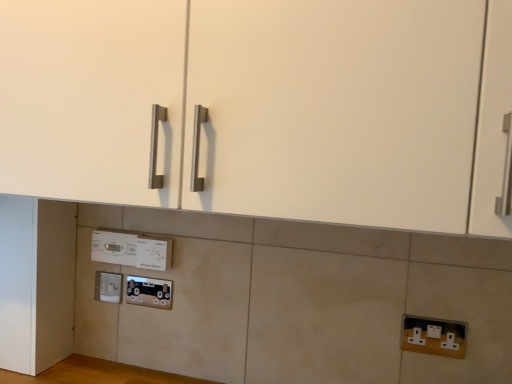
Where is `metallic socket at lower center`? metallic socket at lower center is located at coordinates (149, 292).

What are the coordinates of `white plastic electric outlet at lower center, acting as the 3th electric outlet starting from the bottom` in the screenshot? It's located at (153, 253).

Describe the element at coordinates (153, 253) in the screenshot. The width and height of the screenshot is (512, 384). I see `white plastic electric outlet at lower center, the 2th electric outlet positioned from the left` at that location.

This screenshot has width=512, height=384. I want to click on white plastic electric outlet at lower right, the 1th electric outlet from the right, so click(x=434, y=336).

Where is `white plastic electric outlet at lower left, which is the first electric outlet in back-to-front order`? white plastic electric outlet at lower left, which is the first electric outlet in back-to-front order is located at coordinates (108, 286).

Measure the distance from white plastic thermostat at center to white plastic electric outlet at lower center, which is counted as the 2th electric outlet, starting from the back.

The distance of white plastic thermostat at center from white plastic electric outlet at lower center, which is counted as the 2th electric outlet, starting from the back, is 2.60 inches.

Is white plastic thermostat at center facing towards white plastic electric outlet at lower center, which is the second electric outlet from front to back?

No.

Is white plastic thermostat at center in front of or behind white plastic electric outlet at lower center, which is the second electric outlet from front to back, in the image?

Clearly, white plastic thermostat at center is behind white plastic electric outlet at lower center, which is the second electric outlet from front to back.

Find the location of a particular element. Image resolution: width=512 pixels, height=384 pixels. the 1st electric outlet below the white plastic thermostat at center (from the image's perspective) is located at coordinates (153, 253).

From a real-world perspective, between white plastic electric outlet at lower center, which is counted as the second electric outlet, starting from the right, and white plastic thermostat at center, who is vertically higher?

white plastic thermostat at center is physically above.

From the white plastic thermostat at center, count 1st electric outlets forward and point to it. Please provide its 2D coordinates.

[(153, 253)]

Is white plastic electric outlet at lower center, acting as the 3th electric outlet starting from the bottom, aimed at white plastic thermostat at center?

No, white plastic electric outlet at lower center, acting as the 3th electric outlet starting from the bottom, is not aimed at white plastic thermostat at center.

Is point (138, 242) in front of point (115, 251)?

Yes.

From a real-world perspective, is white plastic electric outlet at lower center, the 2th electric outlet positioned from the left, located beneath white plastic electric outlet at lower left, the 2th electric outlet in the bottom-to-top sequence?

Actually, white plastic electric outlet at lower center, the 2th electric outlet positioned from the left, is physically above white plastic electric outlet at lower left, the 2th electric outlet in the bottom-to-top sequence, in the real world.

Is white plastic electric outlet at lower left, which ranks as the third electric outlet in right-to-left order, a part of white plastic electric outlet at lower center, which is counted as the 2th electric outlet, starting from the back?

No, white plastic electric outlet at lower left, which ranks as the third electric outlet in right-to-left order, is not a part of white plastic electric outlet at lower center, which is counted as the 2th electric outlet, starting from the back.

Locate an element on the screen. The width and height of the screenshot is (512, 384). the 1st electric outlet in front of the white plastic electric outlet at lower left, which is counted as the 2th electric outlet, starting from the top is located at coordinates (153, 253).

How distant is white plastic electric outlet at lower center, which is counted as the second electric outlet, starting from the right, from white plastic electric outlet at lower left, which ranks as the third electric outlet in right-to-left order?

5.91 inches.

Does white plastic electric outlet at lower left, which is the 1th electric outlet in left-to-right order, lie behind white plastic electric outlet at lower right, positioned as the 3th electric outlet in left-to-right order?

Yes, white plastic electric outlet at lower left, which is the 1th electric outlet in left-to-right order, is further from the viewer.

From a real-world perspective, who is located higher, white plastic electric outlet at lower left, acting as the third electric outlet starting from the front, or white plastic electric outlet at lower right, positioned as the 3th electric outlet in left-to-right order?

From a 3D spatial view, white plastic electric outlet at lower left, acting as the third electric outlet starting from the front, is above.

Consider the image. Considering the relative sizes of white plastic electric outlet at lower left, acting as the third electric outlet starting from the front, and white plastic electric outlet at lower right, placed as the third electric outlet when sorted from back to front, in the image provided, is white plastic electric outlet at lower left, acting as the third electric outlet starting from the front, smaller than white plastic electric outlet at lower right, placed as the third electric outlet when sorted from back to front,?

Yes.

Is white plastic electric outlet at lower left, which ranks as the third electric outlet in right-to-left order, to the left of white plastic electric outlet at lower right, placed as the third electric outlet when sorted from back to front, from the viewer's perspective?

Yes, white plastic electric outlet at lower left, which ranks as the third electric outlet in right-to-left order, is to the left of white plastic electric outlet at lower right, placed as the third electric outlet when sorted from back to front.

Does white plastic electric outlet at lower center, which is counted as the second electric outlet, starting from the right, touch metallic socket at lower center?

Yes, white plastic electric outlet at lower center, which is counted as the second electric outlet, starting from the right, is with metallic socket at lower center.

Choose the correct answer: Is white plastic electric outlet at lower center, which is the second electric outlet from front to back, inside metallic socket at lower center or outside it?

white plastic electric outlet at lower center, which is the second electric outlet from front to back, is not inside metallic socket at lower center, it's outside.

Who is bigger, white plastic electric outlet at lower center, acting as the 3th electric outlet starting from the bottom, or metallic socket at lower center?

white plastic electric outlet at lower center, acting as the 3th electric outlet starting from the bottom, is bigger.

Is white plastic electric outlet at lower right, the 1th electric outlet from the right, turned away from white plastic thermostat at center?

That's not correct — white plastic electric outlet at lower right, the 1th electric outlet from the right, is not looking away from white plastic thermostat at center.

Does white plastic electric outlet at lower right, the 1th electric outlet from the right, have a greater width compared to white plastic thermostat at center?

No.

Considering the positions of point (403, 326) and point (105, 246), is point (403, 326) closer or farther from the camera than point (105, 246)?

Clearly, point (403, 326) is closer to the camera than point (105, 246).

At what (x,y) coordinates should I click in order to perform the action: click on appliance that is above the white plastic electric outlet at lower right, the 3th electric outlet from the top (from a real-world perspective). Please return your answer as a coordinate pair (x, y). The image size is (512, 384). Looking at the image, I should click on 114,247.

Is point (52, 338) closer to camera compared to point (434, 332)?

No, it is behind (434, 332).

Who is smaller, white matte door at lower left or white plastic electric outlet at lower right, the 1th electric outlet from the right?

With smaller size is white plastic electric outlet at lower right, the 1th electric outlet from the right.

From a real-world perspective, is white matte door at lower left beneath white plastic electric outlet at lower right, placed as the third electric outlet when sorted from back to front?

No.

Between white matte door at lower left and white plastic electric outlet at lower right, acting as the first electric outlet starting from the bottom, which one has more height?

white matte door at lower left is taller.

Which electric outlet is the 1st one when counting from the front of the white plastic thermostat at center? Please provide its 2D coordinates.

[(153, 253)]

This screenshot has height=384, width=512. There is a white plastic thermostat at center. Find the location of `the 1st electric outlet below it (from a real-world perspective)`. the 1st electric outlet below it (from a real-world perspective) is located at coordinates (153, 253).

Estimate the real-world distances between objects in this image. Which object is closer to white plastic electric outlet at lower center, acting as the 3th electric outlet starting from the bottom, white matte door at lower left or white plastic electric outlet at lower left, which is counted as the 2th electric outlet, starting from the top?

white plastic electric outlet at lower left, which is counted as the 2th electric outlet, starting from the top, lies closer to white plastic electric outlet at lower center, acting as the 3th electric outlet starting from the bottom, than the other object.

From the image, which object appears to be nearer to white plastic thermostat at center, white plastic electric outlet at lower left, which is the first electric outlet in back-to-front order, or white plastic electric outlet at lower right, the 1th electric outlet from the right?

white plastic electric outlet at lower left, which is the first electric outlet in back-to-front order, is positioned closer to the anchor white plastic thermostat at center.

When comparing their distances from white plastic thermostat at center, does white plastic electric outlet at lower right, the 1th electric outlet from the right, or white matte door at lower left seem further?

white plastic electric outlet at lower right, the 1th electric outlet from the right, is positioned further to the anchor white plastic thermostat at center.

From the image, which object appears to be nearer to white plastic electric outlet at lower right, the first electric outlet viewed from the front, metallic socket at lower center or white plastic electric outlet at lower left, which is counted as the 2th electric outlet, starting from the top?

Based on the image, metallic socket at lower center appears to be nearer to white plastic electric outlet at lower right, the first electric outlet viewed from the front.

Consider the image. When comparing their distances from metallic socket at lower center, does white matte door at lower left or white plastic electric outlet at lower right, the 1th electric outlet from the right, seem closer?

white matte door at lower left.

When comparing their distances from white plastic electric outlet at lower left, acting as the third electric outlet starting from the front, does white plastic electric outlet at lower right, the 1th electric outlet from the right, or white plastic thermostat at center seem further?

white plastic electric outlet at lower right, the 1th electric outlet from the right.

When comparing their distances from white plastic electric outlet at lower right, the first electric outlet viewed from the front, does metallic socket at lower center or white plastic thermostat at center seem further?

white plastic thermostat at center.

Considering their positions, is white plastic electric outlet at lower left, which is the first electric outlet in back-to-front order, positioned further to metallic socket at lower center than white plastic electric outlet at lower right, acting as the first electric outlet starting from the bottom?

white plastic electric outlet at lower right, acting as the first electric outlet starting from the bottom, is positioned further to the anchor metallic socket at lower center.

This screenshot has width=512, height=384. Find the location of `electric outlet located between white plastic thermostat at center and white plastic electric outlet at lower right, placed as the third electric outlet when sorted from back to front, in the left-right direction`. electric outlet located between white plastic thermostat at center and white plastic electric outlet at lower right, placed as the third electric outlet when sorted from back to front, in the left-right direction is located at coordinates (153, 253).

This screenshot has width=512, height=384. In order to click on socket located between white plastic electric outlet at lower left, acting as the third electric outlet starting from the front, and white plastic electric outlet at lower center, which is counted as the 2th electric outlet, starting from the back, in the left-right direction in this screenshot , I will do `click(149, 292)`.

You are a GUI agent. You are given a task and a screenshot of the screen. Output one action in this format:
    pyautogui.click(x=<x>, y=<y>)
    Task: Click on the socket between white plastic thermostat at center and white plastic electric outlet at lower right, acting as the first electric outlet starting from the bottom, in the horizontal direction
    
    Given the screenshot: What is the action you would take?
    149,292

Where is `appliance between white matte door at lower left and white plastic electric outlet at lower right, placed as the third electric outlet when sorted from back to front`? The image size is (512, 384). appliance between white matte door at lower left and white plastic electric outlet at lower right, placed as the third electric outlet when sorted from back to front is located at coordinates (114, 247).